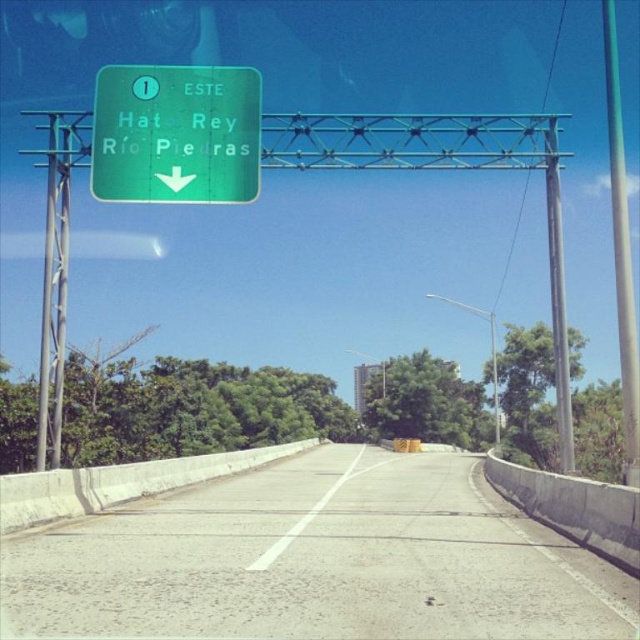
Is gray concrete highway at center above metallic gray pole at right?

No, gray concrete highway at center is not above metallic gray pole at right.

Which is above, gray concrete highway at center or metallic gray pole at right?

metallic gray pole at right is higher up.

Locate an element on the screen. gray concrete highway at center is located at coordinates (316, 560).

You are a GUI agent. You are given a task and a screenshot of the screen. Output one action in this format:
    pyautogui.click(x=<x>, y=<y>)
    Task: Click on the gray concrete highway at center
    
    Given the screenshot: What is the action you would take?
    pyautogui.click(x=316, y=560)

Where is `green glossy sign at upper center`? The height and width of the screenshot is (640, 640). green glossy sign at upper center is located at coordinates (176, 134).

Does green glossy sign at upper center have a greater height compared to green metallic pole at right?

In fact, green glossy sign at upper center may be shorter than green metallic pole at right.

This screenshot has width=640, height=640. In order to click on green glossy sign at upper center in this screenshot , I will do `click(176, 134)`.

You are a GUI agent. You are given a task and a screenshot of the screen. Output one action in this format:
    pyautogui.click(x=<x>, y=<y>)
    Task: Click on the green glossy sign at upper center
    The width and height of the screenshot is (640, 640).
    Given the screenshot: What is the action you would take?
    pyautogui.click(x=176, y=134)

Which of these two, gray concrete highway at center or green metallic pole at right, stands shorter?

Standing shorter between the two is gray concrete highway at center.

Is point (620, 628) positioned behind point (632, 387)?

No, it is in front of (632, 387).

Measure the distance between point (180, 621) and camera.

Point (180, 621) is 8.00 meters away from camera.

Image resolution: width=640 pixels, height=640 pixels. I want to click on gray concrete highway at center, so click(316, 560).